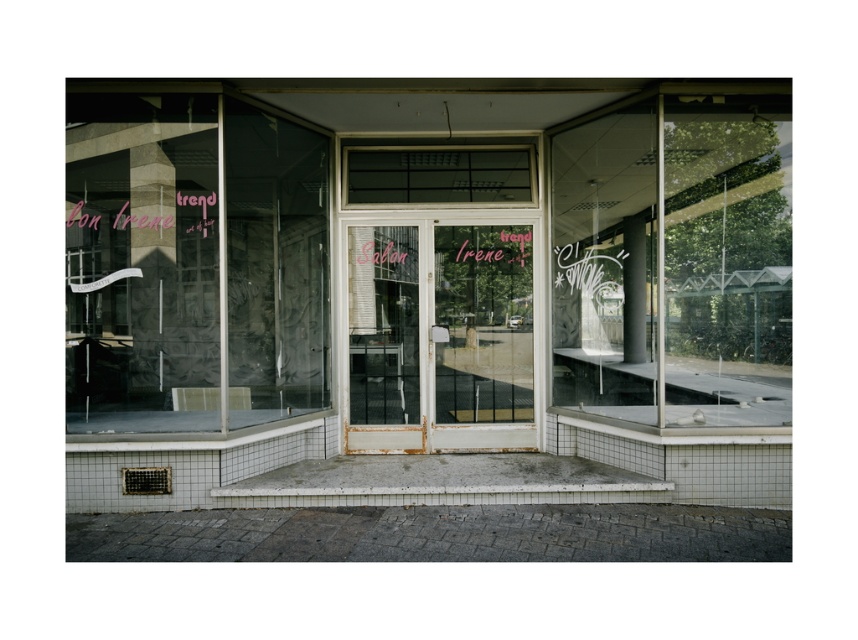
You are a window installer assessing the storefront. You need to replace the transparent glass at left and the transparent glass window at center with new panes. Which pane requires a wider piece of glass?

The transparent glass at left requires a wider piece of glass because its width is larger than the transparent glass window at center.

You are a window cleaner who needs to clean the transparent glass at left and the transparent glass window at center on the facade of the closed storefront. Based on their positions, which window should you clean first if you start from the ground and move upward?

The transparent glass at left should be cleaned first because it is positioned below the transparent glass window at center, so starting from the ground and moving upward, you would reach it first.

You are standing in front of the closed storefront of Salon Irene. You notice a specific point at coordinates (427, 284). What object does this point correspond to?

The point corresponds to the transparent glass storefront at center.